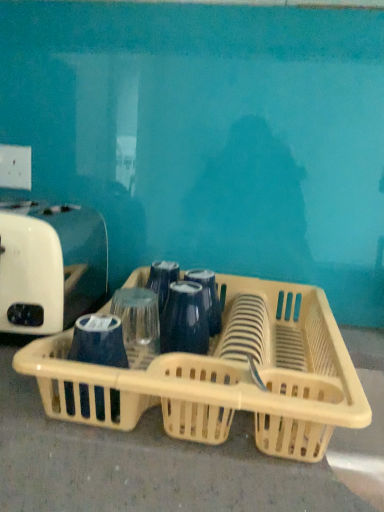
Describe the element at coordinates (223, 376) in the screenshot. I see `beige plastic basket at center` at that location.

At what (x,y) coordinates should I click in order to perform the action: click on beige plastic basket at center. Please return your answer as a coordinate pair (x, y). Looking at the image, I should click on (223, 376).

Measure the distance between white plastic toaster at left and camera.

white plastic toaster at left is 23.29 inches from camera.

Where is `white plastic toaster at left`? The width and height of the screenshot is (384, 512). white plastic toaster at left is located at coordinates pos(49,265).

Describe the element at coordinates (49, 265) in the screenshot. The image size is (384, 512). I see `white plastic toaster at left` at that location.

Image resolution: width=384 pixels, height=512 pixels. What are the coordinates of `beige plastic basket at center` in the screenshot? It's located at (223, 376).

Would you say white plastic toaster at left is to the left or to the right of beige plastic basket at center in the picture?

Clearly, white plastic toaster at left is on the left of beige plastic basket at center in the image.

Does white plastic toaster at left come in front of beige plastic basket at center?

No, white plastic toaster at left is further to the viewer.

Which point is more distant from viewer, (64, 265) or (358, 403)?

The point (64, 265) is farther from the camera.

From the image's perspective, relative to beige plastic basket at center, is white plastic toaster at left above or below?

Based on their image positions, white plastic toaster at left is located above beige plastic basket at center.

From a real-world perspective, is white plastic toaster at left physically located above or below beige plastic basket at center?

white plastic toaster at left is situated higher than beige plastic basket at center in the real world.

Which of these two, white plastic toaster at left or beige plastic basket at center, is thinner?

white plastic toaster at left is thinner.

Based on the photo, can you confirm if white plastic toaster at left is taller than beige plastic basket at center?

Yes.

Between white plastic toaster at left and beige plastic basket at center, which one has larger size?

With larger size is beige plastic basket at center.

Is white plastic toaster at left inside the boundaries of beige plastic basket at center, or outside?

white plastic toaster at left is not enclosed by beige plastic basket at center.

Can you see white plastic toaster at left touching beige plastic basket at center?

No, white plastic toaster at left is not making contact with beige plastic basket at center.

Is white plastic toaster at left oriented towards beige plastic basket at center?

No, white plastic toaster at left is not facing towards beige plastic basket at center.

How many degrees apart are the facing directions of white plastic toaster at left and beige plastic basket at center?

There is a 1.33-degree angle between the facing directions of white plastic toaster at left and beige plastic basket at center.

Image resolution: width=384 pixels, height=512 pixels. Find the location of `toaster that appears above the beige plastic basket at center (from the image's perspective)`. toaster that appears above the beige plastic basket at center (from the image's perspective) is located at coordinates (49, 265).

Based on the photo, between beige plastic basket at center and white plastic toaster at left, which one appears on the left side from the viewer's perspective?

Positioned to the left is white plastic toaster at left.

Is beige plastic basket at center positioned in front of white plastic toaster at left?

Yes, beige plastic basket at center is closer to the viewer.

Which is further, (x=342, y=344) or (x=3, y=278)?

The point (x=3, y=278) is behind.

From the image's perspective, is beige plastic basket at center located above or below white plastic toaster at left?

Based on their image positions, beige plastic basket at center is located beneath white plastic toaster at left.

From a real-world perspective, which object stands above the other?

From a 3D spatial view, white plastic toaster at left is above.

From the picture: Which object is wider, beige plastic basket at center or white plastic toaster at left?

beige plastic basket at center is wider.

Looking at this image, is beige plastic basket at center shorter than white plastic toaster at left?

Indeed, beige plastic basket at center has a lesser height compared to white plastic toaster at left.

Considering the relative sizes of beige plastic basket at center and white plastic toaster at left in the image provided, is beige plastic basket at center smaller than white plastic toaster at left?

No.

Is white plastic toaster at left a part of beige plastic basket at center?

Definitely not — white plastic toaster at left is not inside beige plastic basket at center.

Would you consider beige plastic basket at center to be distant from white plastic toaster at left?

No, beige plastic basket at center is in close proximity to white plastic toaster at left.

Could you tell me if beige plastic basket at center is turned towards white plastic toaster at left?

No, beige plastic basket at center is not aimed at white plastic toaster at left.

How distant is beige plastic basket at center from white plastic toaster at left?

The distance of beige plastic basket at center from white plastic toaster at left is 23.45 centimeters.

This screenshot has width=384, height=512. What are the coordinates of `toaster on the left side of beige plastic basket at center` in the screenshot? It's located at (49, 265).

In the image, there is a white plastic toaster at left. Identify the location of basket below it (from a real-world perspective). (223, 376).

At what (x,y) coordinates should I click in order to perform the action: click on toaster on the left of beige plastic basket at center. Please return your answer as a coordinate pair (x, y). Looking at the image, I should click on (49, 265).